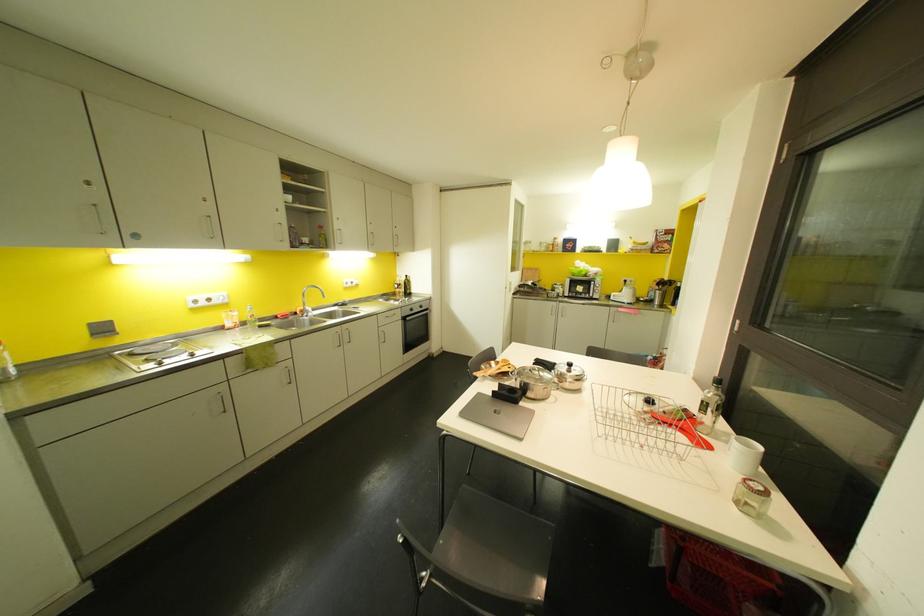
Image resolution: width=924 pixels, height=616 pixels. Describe the element at coordinates (492, 536) in the screenshot. I see `the chair sitting surface` at that location.